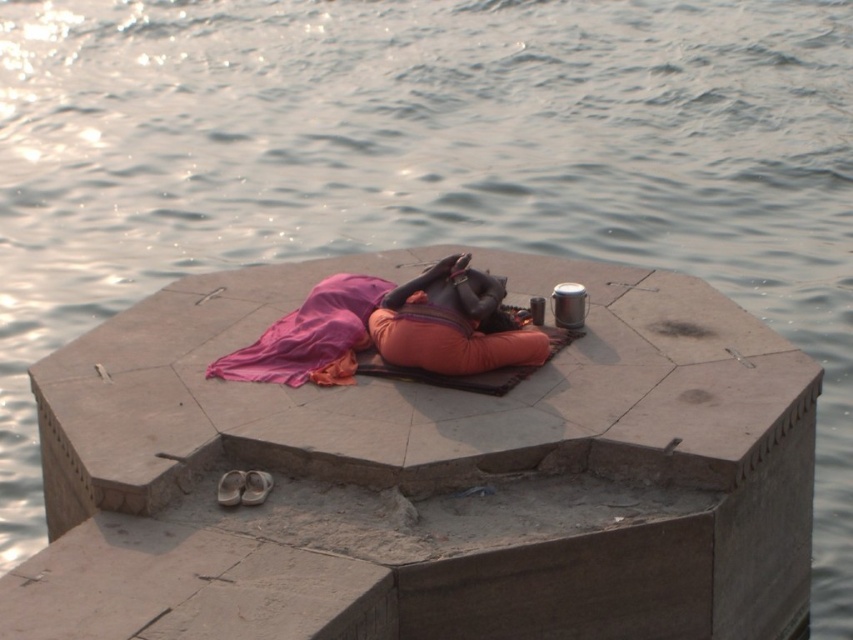
You are a photographer trying to capture the scene with a wide angle lens. You notice two fabrics at the center of the image, the orange fabric at center and the pink fabric at center. Which fabric should you focus on if you want to include both in the frame without cropping either?

The orange fabric at center is smaller than the pink fabric at center, so you should focus on the larger pink fabric at center to ensure both fit in the frame.

Based on the photo, you are standing in the scene and want to place a small item exactly at the center of the orange fabric at center. What coordinates should you use?

The coordinates for the orange fabric at center are point (451,323), so you should place the item at those coordinates.

You are standing in the scene and want to place a small object on the closest point to you between point (399,346) and point (264,349). Which point should you choose?

Point (399,346) is closer to the viewer than point (264,349), so you should choose point (399,346).